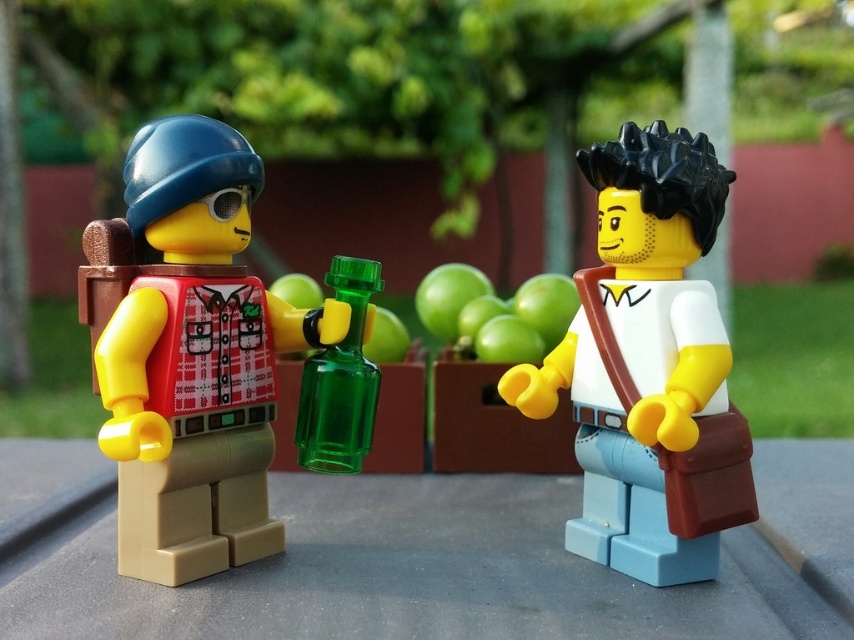
Question: Does matte green glass bottle at left appear under green translucent bottle at center?

Choices:
 (A) yes
 (B) no

Answer: (B)

Question: Which point is farther to the camera?

Choices:
 (A) (197, 269)
 (B) (358, 392)
 (C) (50, 628)
 (D) (664, 276)

Answer: (B)

Question: Is matte green glass bottle at left wider than white matte shirt at center?

Choices:
 (A) yes
 (B) no

Answer: (A)

Question: Can you confirm if white matte shirt at center is positioned below green translucent bottle at center?

Choices:
 (A) no
 (B) yes

Answer: (A)

Question: Estimate the real-world distances between objects in this image. Which object is farther from the white matte shirt at center?

Choices:
 (A) green translucent bottle at center
 (B) matte green glass bottle at left
 (C) smooth gray table at center

Answer: (B)

Question: Considering the real-world distances, which object is closest to the white matte shirt at center?

Choices:
 (A) smooth gray table at center
 (B) green translucent bottle at center

Answer: (A)